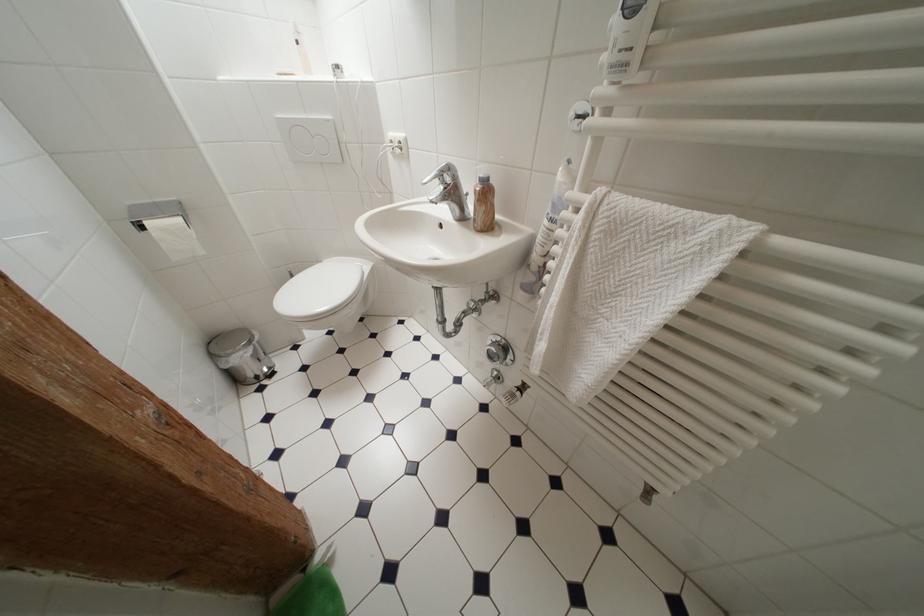
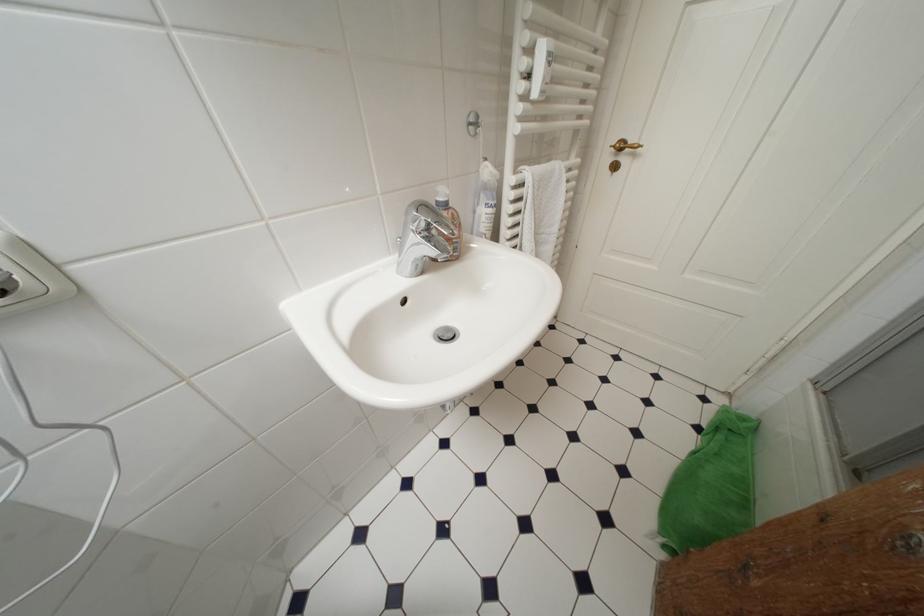
Based on the continuous images, in which direction is the camera rotating?

The rotation direction of the camera is right-down.